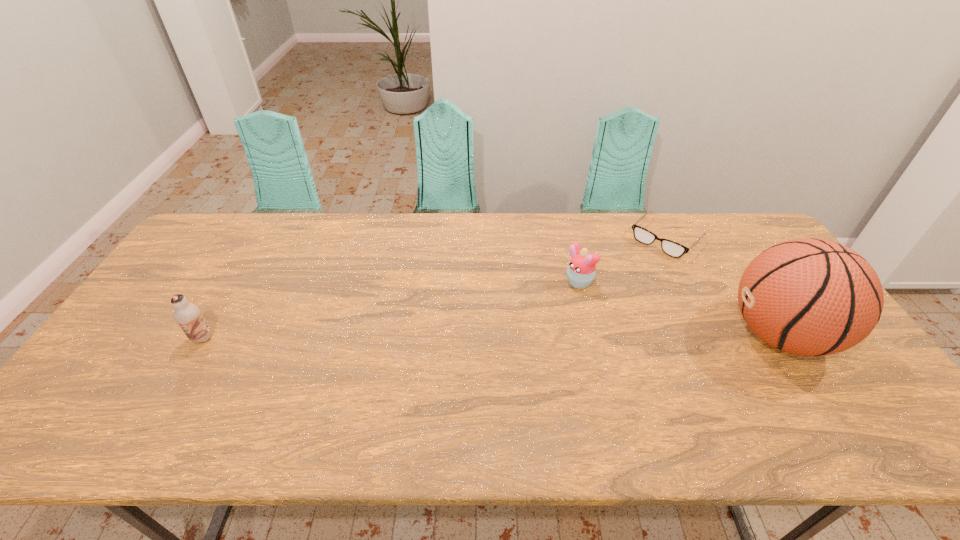
Where is `object that is at the near right corner`? This screenshot has width=960, height=540. object that is at the near right corner is located at coordinates (810, 297).

Image resolution: width=960 pixels, height=540 pixels. What are the coordinates of `vacant space at the far edge` in the screenshot? It's located at (538, 240).

In the image, there is a desktop. Where is `free region at the near edge`? free region at the near edge is located at coordinates (519, 396).

Where is `vacant space at the left edge of the desktop`? Image resolution: width=960 pixels, height=540 pixels. vacant space at the left edge of the desktop is located at coordinates (149, 347).

This screenshot has width=960, height=540. In the image, there is a desktop. What are the coordinates of `vacant space at the far left corner` in the screenshot? It's located at (251, 223).

Where is `vacant region at the far right corner of the desktop`? vacant region at the far right corner of the desktop is located at coordinates (764, 241).

Locate an element on the screen. This screenshot has height=540, width=960. free space between the spectacles and the tallest object is located at coordinates (723, 287).

At what (x,y) coordinates should I click in order to perform the action: click on vacant area that lies between the shortest object and the leftmost object. Please return your answer as a coordinate pair (x, y). Image resolution: width=960 pixels, height=540 pixels. Looking at the image, I should click on (434, 288).

The height and width of the screenshot is (540, 960). I want to click on vacant space that's between the chocolate milk and the tallest object, so click(491, 336).

I want to click on vacant area that lies between the leftmost object and the farthest object, so click(434, 288).